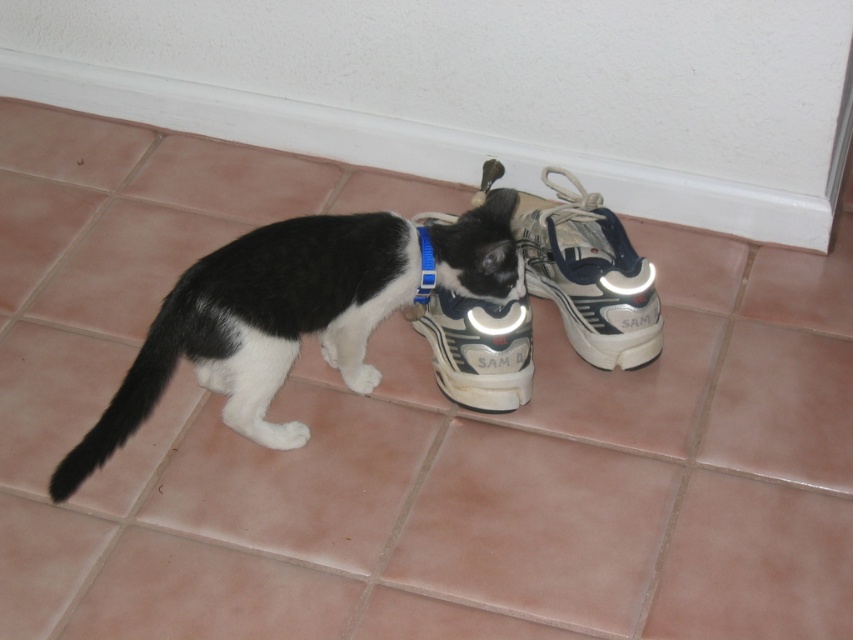
You are a robot with a camera that has a minimum focus distance of 1.2 meters. You want to take a clear photo of the white synthetic shoe at center. Can you focus on it from your current position?

The distance between the white synthetic shoe at center and the viewer is 1.35 meters, which is greater than the camera minimum focus distance of 1.2 meters. Therefore, the robot can focus on the white synthetic shoe at center from its current position.

You are standing in the room and see two points marked on the tiled floor. The first point is at coordinate point (492, 195) and the second is at point (631, 324). Which point is closer to you?

Point (492, 195) is closer to you because it is further to the viewer than point (631, 324).